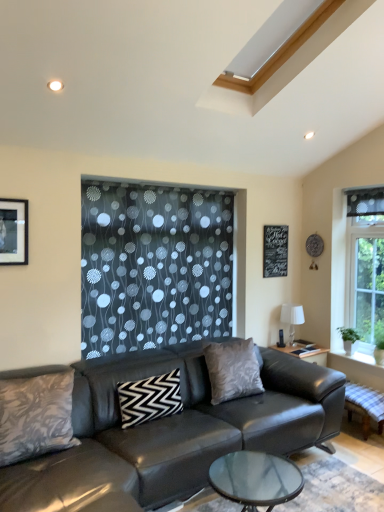
What is the approximate width of leather couch at center?

The width of leather couch at center is 2.25 meters.

Identify the location of silky gray pillow at center, placed as the 3th pillow when sorted from left to right. (232, 370).

In order to face white textured stone window sill at lower right, should I rotate leftwards or rightwards?

Turn right by 21.761 degrees to look at white textured stone window sill at lower right.

Image resolution: width=384 pixels, height=512 pixels. Find the location of `leather couch at center`. leather couch at center is located at coordinates (172, 431).

Is point (256, 384) positioned behind point (9, 405)?

Yes, point (256, 384) is behind point (9, 405).

Does silky gray pillow at center, placed as the 3th pillow when sorted from left to right, turn towards textured gray pillow at lower left, marked as the third pillow in a right-to-left arrangement?

No, silky gray pillow at center, placed as the 3th pillow when sorted from left to right, is not aimed at textured gray pillow at lower left, marked as the third pillow in a right-to-left arrangement.

From a real-world perspective, relative to textured gray pillow at lower left, marked as the third pillow in a right-to-left arrangement, is silky gray pillow at center, positioned as the 1th pillow in back-to-front order, vertically above or below?

silky gray pillow at center, positioned as the 1th pillow in back-to-front order, is situated higher than textured gray pillow at lower left, marked as the third pillow in a right-to-left arrangement, in the real world.

Considering the relative sizes of silky gray pillow at center, the first pillow when ordered from right to left, and textured gray pillow at lower left, marked as the third pillow in a right-to-left arrangement, in the image provided, is silky gray pillow at center, the first pillow when ordered from right to left, taller than textured gray pillow at lower left, marked as the third pillow in a right-to-left arrangement,?

No, silky gray pillow at center, the first pillow when ordered from right to left, is not taller than textured gray pillow at lower left, marked as the third pillow in a right-to-left arrangement.

Consider the image. From a real-world perspective, which object rests below the other?

leather couch at center.

From the image's perspective, is textured gray pillow at lower left, the first pillow from the front, on top of leather couch at center?

Yes, from the image's perspective, textured gray pillow at lower left, the first pillow from the front, is above leather couch at center.

Based on the photo, is textured gray pillow at lower left, the first pillow from the front, positioned beyond the bounds of leather couch at center?

Actually, textured gray pillow at lower left, the first pillow from the front, is within leather couch at center.

Choose the correct answer: Is black zigzag pillow at center, which is counted as the 2th pillow, starting from the front, inside silky gray pillow at center, which is counted as the 3th pillow, starting from the front, or outside it?

black zigzag pillow at center, which is counted as the 2th pillow, starting from the front, is not inside silky gray pillow at center, which is counted as the 3th pillow, starting from the front, it's outside.

Is point (165, 412) closer or farther from the camera than point (252, 377)?

Point (165, 412) is closer to the camera than point (252, 377).

Does black zigzag pillow at center, the 2th pillow viewed from the right, have a greater width compared to silky gray pillow at center, which is counted as the 3th pillow, starting from the front?

Yes, black zigzag pillow at center, the 2th pillow viewed from the right, is wider than silky gray pillow at center, which is counted as the 3th pillow, starting from the front.

In the image, is white textured stone window sill at lower right positioned in front of or behind matte black picture frame at upper left?

Visually, white textured stone window sill at lower right is located behind matte black picture frame at upper left.

Locate an element on the screen. The height and width of the screenshot is (512, 384). picture frame on the left of white textured stone window sill at lower right is located at coordinates (13, 232).

Which point is more distant from viewer, (x=330, y=354) or (x=8, y=217)?

Point (x=330, y=354)

In the image, there is a black chalkboard at upper center. In order to click on picture frame above it (from the image's perspective) in this screenshot , I will do `click(13, 232)`.

Is black chalkboard at upper center inside the boundaries of matte black picture frame at upper left, or outside?

black chalkboard at upper center is spatially situated outside matte black picture frame at upper left.

Between black chalkboard at upper center and matte black picture frame at upper left, which one has larger size?

black chalkboard at upper center.

Can you confirm if textured gray pillow at lower left, which is counted as the third pillow, starting from the back, is taller than matte black picture frame at upper left?

Yes.

Could you tell me if textured gray pillow at lower left, placed as the 1th pillow when sorted from left to right, is facing matte black picture frame at upper left?

No, textured gray pillow at lower left, placed as the 1th pillow when sorted from left to right, is not facing towards matte black picture frame at upper left.

Is textured gray pillow at lower left, which is counted as the third pillow, starting from the back, at the right side of matte black picture frame at upper left?

Yes, textured gray pillow at lower left, which is counted as the third pillow, starting from the back, is to the right of matte black picture frame at upper left.

Can you tell me how much white textured stone window sill at lower right and black chalkboard at upper center differ in facing direction?

The angular difference between white textured stone window sill at lower right and black chalkboard at upper center is 90.5 degrees.

Is point (344, 357) positioned before point (274, 228)?

Yes, point (344, 357) is closer to viewer.

Considering the sizes of objects white textured stone window sill at lower right and black chalkboard at upper center in the image provided, who is wider, white textured stone window sill at lower right or black chalkboard at upper center?

white textured stone window sill at lower right is wider.

Locate an element on the screen. the 2nd pillow in front when counting from the silky gray pillow at center, which is counted as the 3th pillow, starting from the front is located at coordinates (35, 415).

From the image's perspective, starting from the leather couch at center, which pillow is the 2nd one above? Please provide its 2D coordinates.

[(35, 415)]

Which object lies further to the anchor point black zigzag pillow at center, which is the second pillow in left-to-right order, leather couch at center or white textured stone window sill at lower right?

white textured stone window sill at lower right.

Considering their positions, is black chalkboard at upper center positioned further to white textured stone window sill at lower right than leather couch at center?

Among the two, leather couch at center is located further to white textured stone window sill at lower right.

Estimate the real-world distances between objects in this image. Which object is further from matte black picture frame at upper left, black zigzag pillow at center, which is counted as the 2th pillow, starting from the front, or white fabric lampshade at right?

white fabric lampshade at right lies further to matte black picture frame at upper left than the other object.

When comparing their distances from matte black picture frame at upper left, does black zigzag pillow at center, which is the second pillow in left-to-right order, or silky gray pillow at center, placed as the 3th pillow when sorted from left to right, seem closer?

black zigzag pillow at center, which is the second pillow in left-to-right order, lies closer to matte black picture frame at upper left than the other object.

When comparing their distances from black zigzag pillow at center, which is counted as the 2th pillow, starting from the front, does textured gray pillow at lower left, which is counted as the third pillow, starting from the back, or matte black picture frame at upper left seem closer?

textured gray pillow at lower left, which is counted as the third pillow, starting from the back, is positioned closer to the anchor black zigzag pillow at center, which is counted as the 2th pillow, starting from the front.

When comparing their distances from textured gray pillow at lower left, marked as the third pillow in a right-to-left arrangement, does white fabric lampshade at right or black zigzag pillow at center, placed as the second pillow when sorted from back to front, seem closer?

black zigzag pillow at center, placed as the second pillow when sorted from back to front, lies closer to textured gray pillow at lower left, marked as the third pillow in a right-to-left arrangement, than the other object.

Considering their positions, is leather couch at center positioned closer to white fabric lampshade at right than textured gray pillow at lower left, marked as the third pillow in a right-to-left arrangement?

leather couch at center lies closer to white fabric lampshade at right than the other object.

Which object lies nearer to the anchor point silky gray pillow at center, positioned as the 1th pillow in back-to-front order, leather couch at center or matte black picture frame at upper left?

Based on the image, leather couch at center appears to be nearer to silky gray pillow at center, positioned as the 1th pillow in back-to-front order.

Identify the location of lamp between textured gray pillow at lower left, which is counted as the third pillow, starting from the back, and white textured stone window sill at lower right from left to right. (292, 318).

The height and width of the screenshot is (512, 384). What are the coordinates of `lamp between black zigzag pillow at center, which is counted as the 2th pillow, starting from the front, and white textured stone window sill at lower right from left to right` in the screenshot? It's located at (292, 318).

Locate an element on the screen. The height and width of the screenshot is (512, 384). lamp located between silky gray pillow at center, placed as the 3th pillow when sorted from left to right, and white textured stone window sill at lower right in the left-right direction is located at coordinates (292, 318).

I want to click on picture frame between leather couch at center and silky gray pillow at center, which is counted as the 3th pillow, starting from the front, along the z-axis, so click(13, 232).